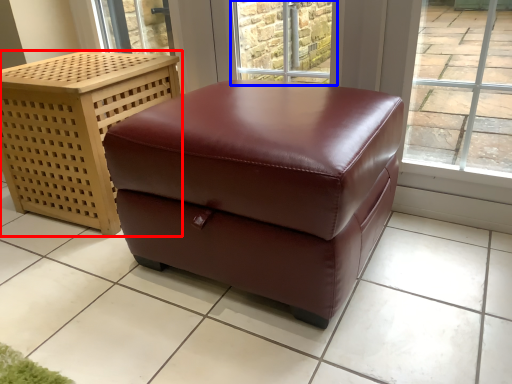
Question: Which point is further to the camera, furniture (highlighted by a red box) or window (highlighted by a blue box)?

Choices:
 (A) furniture
 (B) window

Answer: (B)